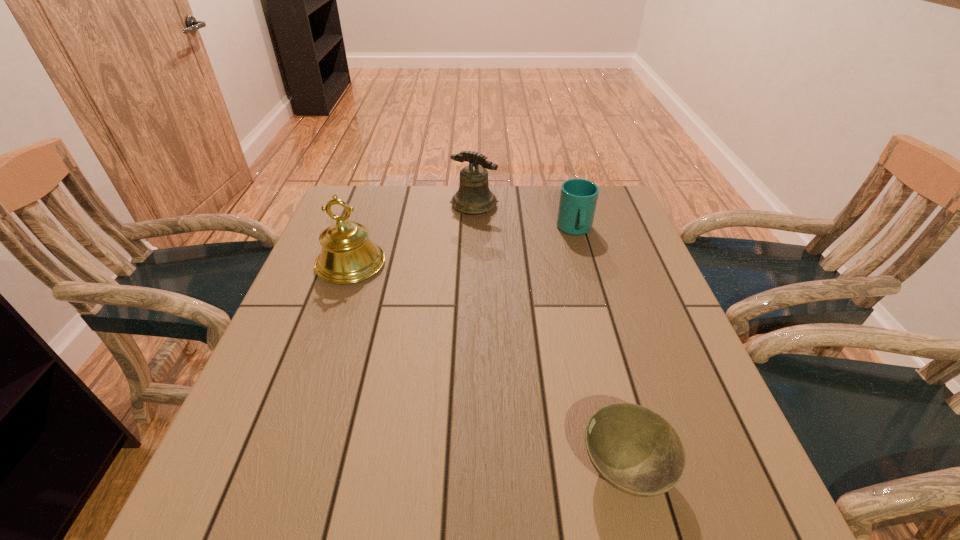
Image resolution: width=960 pixels, height=540 pixels. Identify the location of vacant area located on the back of the shortest object. (600, 374).

Find the location of a particular element. This screenshot has width=960, height=540. bell that is at the far edge is located at coordinates (474, 196).

You are a GUI agent. You are given a task and a screenshot of the screen. Output one action in this format:
    pyautogui.click(x=<x>, y=<y>)
    Task: Click on the cup that is at the far edge
    Image resolution: width=960 pixels, height=540 pixels.
    Given the screenshot: What is the action you would take?
    pyautogui.click(x=578, y=197)

The height and width of the screenshot is (540, 960). Identify the location of object that is positioned at the near edge. (637, 451).

The image size is (960, 540). I want to click on object that is at the left edge, so click(348, 255).

Locate an element on the screen. cup situated at the right edge is located at coordinates (578, 197).

Where is `bowl that is positioned at the right edge`? bowl that is positioned at the right edge is located at coordinates (637, 451).

Find the location of a particular element. The image size is (960, 540). object that is at the far right corner is located at coordinates (578, 197).

Identify the location of object that is positioned at the near right corner. (637, 451).

Where is `vacant space at the far edge of the desktop`? vacant space at the far edge of the desktop is located at coordinates [411, 202].